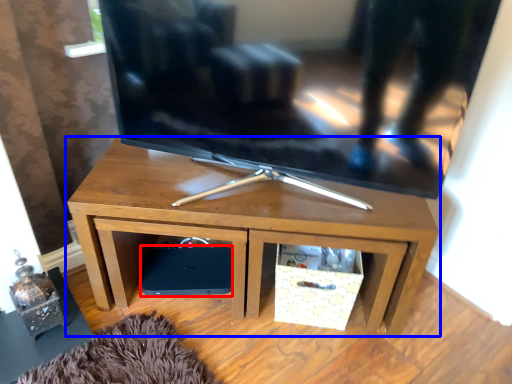
Question: Among these objects, which one is farthest to the camera, speaker (highlighted by a red box) or desk (highlighted by a blue box)?

Choices:
 (A) speaker
 (B) desk

Answer: (A)